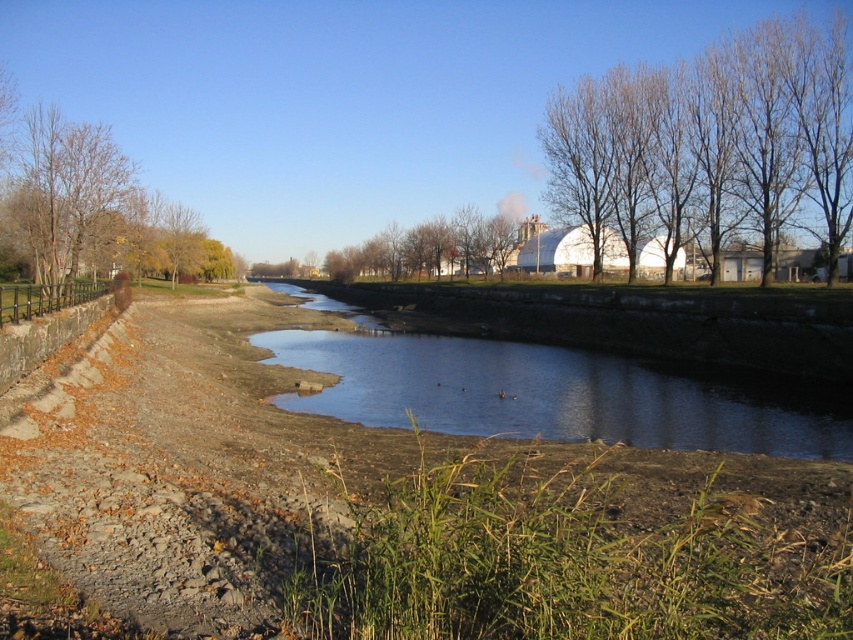
Does clear water at center have a greater width compared to brown leafy tree at center?

Incorrect, clear water at center's width does not surpass brown leafy tree at center's.

Who is more forward, (390, 404) or (473, 211)?

Positioned in front is point (390, 404).

Between point (560, 387) and point (383, 269), which one is positioned behind?

Point (383, 269)

Where is `clear water at center`? The height and width of the screenshot is (640, 853). clear water at center is located at coordinates (554, 390).

Who is more distant from viewer, [367,388] or [57,136]?

The point [57,136] is more distant.

Does clear water at center appear under brown leafy tree at left?

Correct, clear water at center is located below brown leafy tree at left.

Who is more forward, (764, 400) or (186, 273)?

Point (764, 400) is more forward.

At what (x,y) coordinates should I click in order to perform the action: click on clear water at center. Please return your answer as a coordinate pair (x, y). The width and height of the screenshot is (853, 640). Looking at the image, I should click on (554, 390).

Is bare branches at upper right taller than brown leafy tree at center?

Yes, bare branches at upper right is taller than brown leafy tree at center.

You are a GUI agent. You are given a task and a screenshot of the screen. Output one action in this format:
    pyautogui.click(x=<x>, y=<y>)
    Task: Click on the bare branches at upper right
    
    Given the screenshot: What is the action you would take?
    pyautogui.click(x=712, y=141)